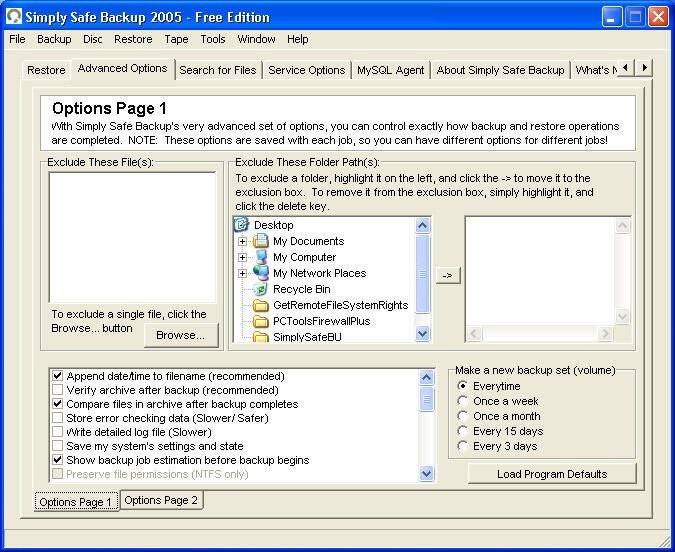
At what (x,y) coordinates should I click in order to perform the action: click on desktop file. Please return your answer as a coordinate pair (x, y). The height and width of the screenshot is (552, 675). Looking at the image, I should click on (241, 222), (144, 464).